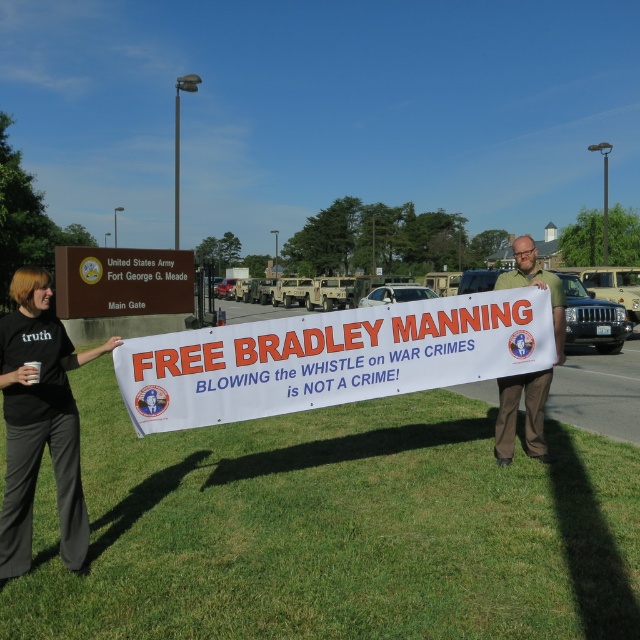
Between point (250, 429) and point (525, 266), which one is positioned in front?

Positioned in front is point (525, 266).

How far apart are green grass at lower center and green fabric sign at center?

A distance of 3.02 meters exists between green grass at lower center and green fabric sign at center.

Locate an element on the screen. The width and height of the screenshot is (640, 640). green grass at lower center is located at coordinates (337, 529).

Find the location of a particular element. The image size is (640, 640). green grass at lower center is located at coordinates (337, 529).

Describe the element at coordinates (122, 282) in the screenshot. Image resolution: width=640 pixels, height=640 pixels. I see `white paper banner at center` at that location.

Does point (156, 305) lie in front of point (502, 380)?

No, (156, 305) is behind (502, 380).

Is point (180, 296) farther from camera compared to point (516, 397)?

Yes.

At what (x,y) coordinates should I click in order to perform the action: click on white paper banner at center. Please return your answer as a coordinate pair (x, y). This screenshot has width=640, height=640. Looking at the image, I should click on (122, 282).

Between green grass at lower center and black fabric shirt at lower left, which one appears on the left side from the viewer's perspective?

From the viewer's perspective, black fabric shirt at lower left appears more on the left side.

Is point (106, 369) more distant than point (38, 296)?

Yes, it is.

Is point (323, 634) positioned behind point (3, 346)?

No, it is in front of (3, 346).

This screenshot has width=640, height=640. I want to click on green grass at lower center, so click(337, 529).